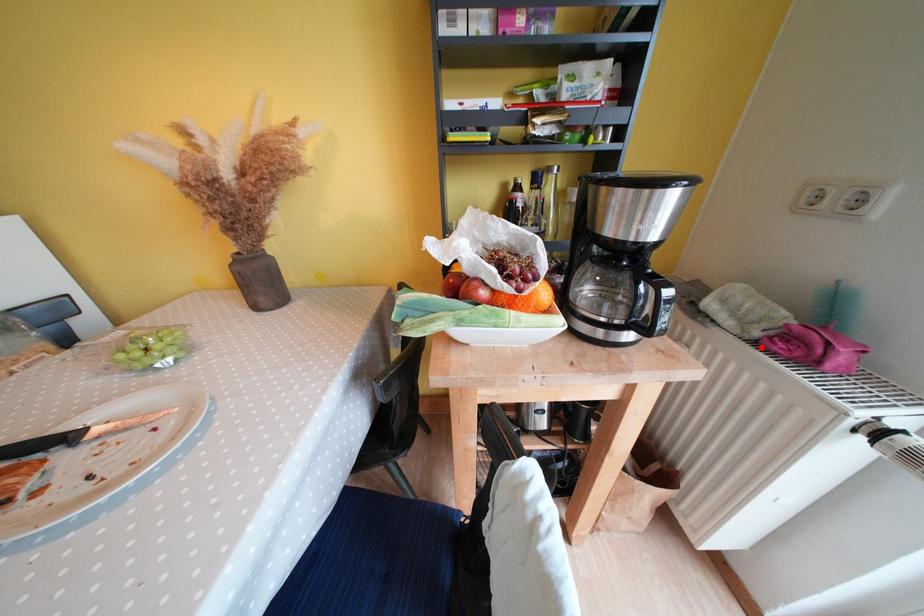
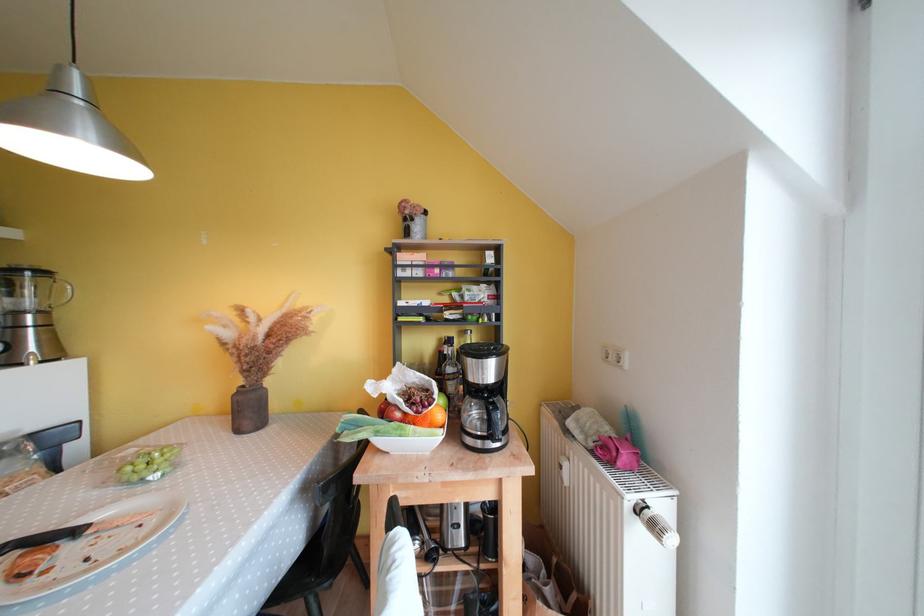
Where in the second image is the point corresponding to the highlighted location from the first image?

(599, 456)